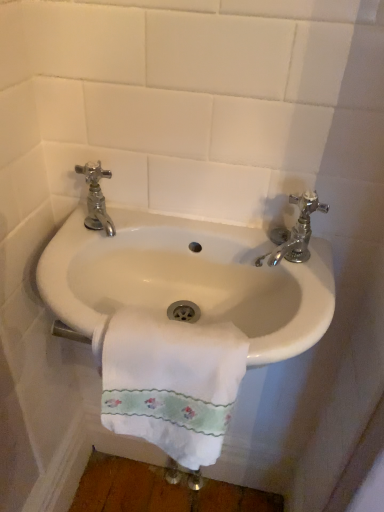
What are the coordinates of `vacant space situated above white cotton towel at center (from a real-world perspective)` in the screenshot? It's located at (172, 339).